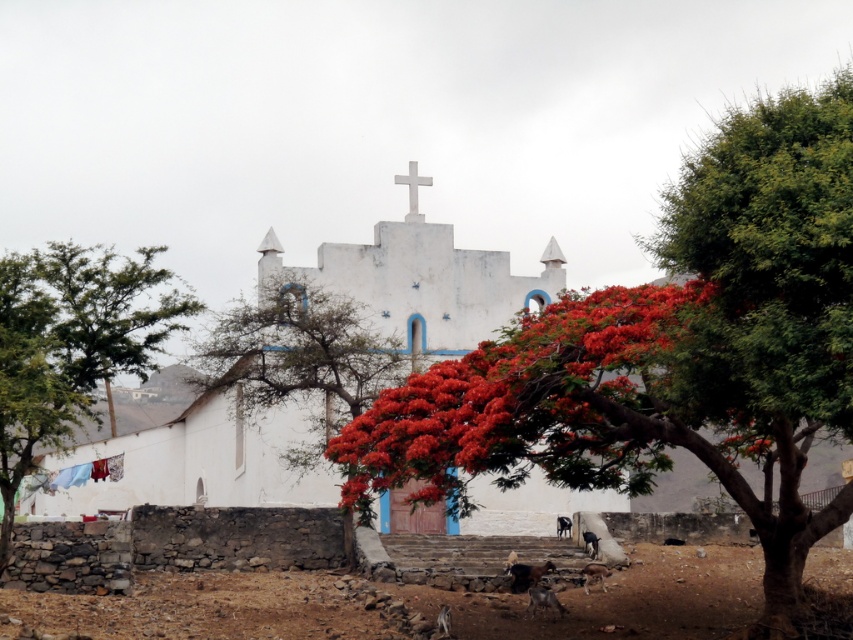
Question: Is brown dirt field at lower center bigger than white matte cross at center?

Choices:
 (A) no
 (B) yes

Answer: (B)

Question: Which object is the farthest from the white matte church at center?

Choices:
 (A) smooth white tree at center
 (B) brown dirt field at lower center

Answer: (B)

Question: Can you confirm if brown dirt field at lower center is positioned above white matte cross at center?

Choices:
 (A) no
 (B) yes

Answer: (A)

Question: Which of the following is the closest to the observer?

Choices:
 (A) (410, 177)
 (B) (427, 305)
 (C) (525, 596)
 (D) (635, 388)

Answer: (D)

Question: Does bright red leaves at center have a smaller size compared to brown dirt field at lower center?

Choices:
 (A) yes
 (B) no

Answer: (B)

Question: Which point appears farthest from the camera in this image?

Choices:
 (A) (20, 627)
 (B) (256, 333)

Answer: (B)